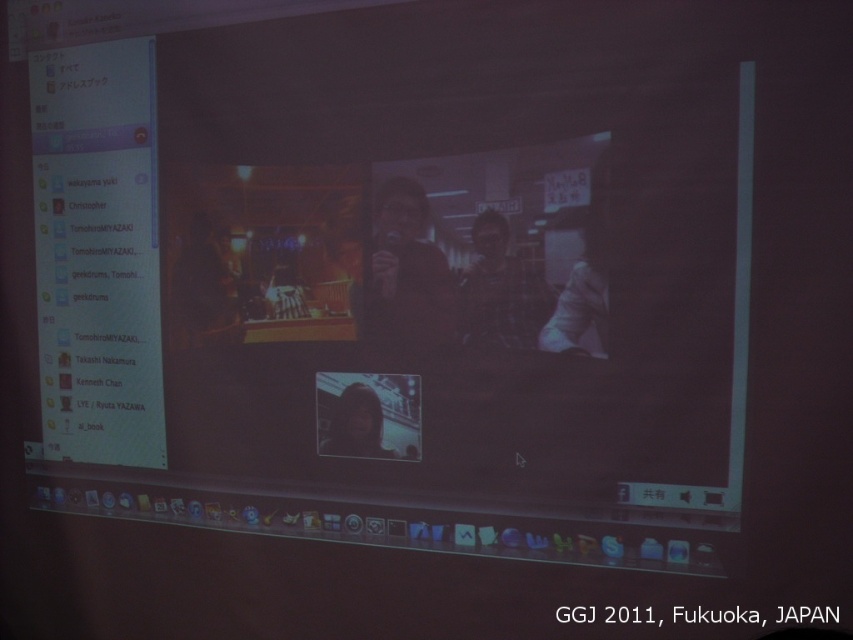
Question: Considering the real-world distances, which object is farthest from the white fabric at center?

Choices:
 (A) dark fabric microphone at center
 (B) plaid shirt at center

Answer: (A)

Question: Is matte black microphone at center bigger than white fabric at center?

Choices:
 (A) no
 (B) yes

Answer: (B)

Question: Does plaid shirt at center have a lesser width compared to white fabric at center?

Choices:
 (A) no
 (B) yes

Answer: (A)

Question: Which point is closer to the camera?

Choices:
 (A) (444, 273)
 (B) (227, 284)
 (C) (502, 336)

Answer: (C)

Question: Considering the real-world distances, which object is closest to the dark fabric microphone at center?

Choices:
 (A) smooth skin face at center
 (B) matte black microphone at center

Answer: (A)

Question: Is matte black microphone at center positioned in front of dark fabric microphone at center?

Choices:
 (A) no
 (B) yes

Answer: (B)